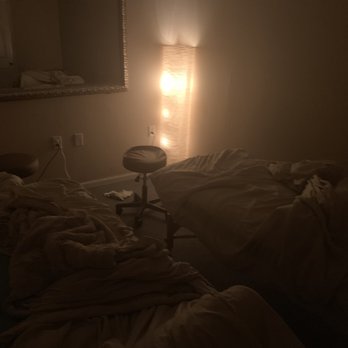
At what (x,y) coordinates should I click in order to perform the action: click on mess. Please return your answer as a coordinate pair (x, y). The image size is (348, 348). Looking at the image, I should click on (249, 198).